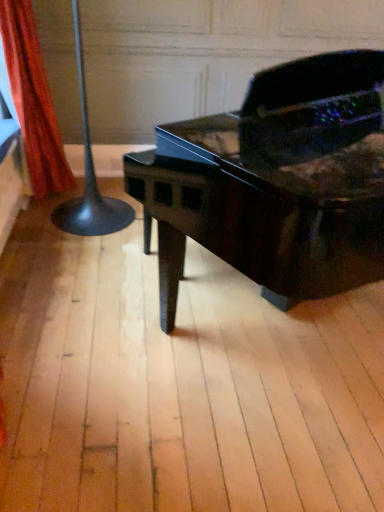
You are a GUI agent. You are given a task and a screenshot of the screen. Output one action in this format:
    pyautogui.click(x=<x>, y=<y>)
    Task: Click on the vacant space in front of orange fabric curtain at left
    This screenshot has width=384, height=512.
    Given the screenshot: What is the action you would take?
    pyautogui.click(x=43, y=238)